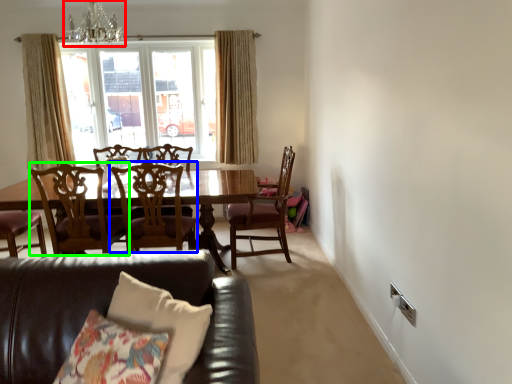
Question: Which is farther away from chandelier (highlighted by a red box)? chair (highlighted by a blue box) or chair (highlighted by a green box)?

Choices:
 (A) chair
 (B) chair

Answer: (A)